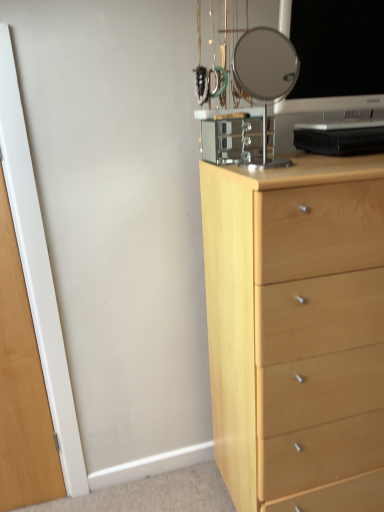
Question: From a real-world perspective, is black glossy computer monitor at upper right below light wood chest of drawers at right?

Choices:
 (A) no
 (B) yes

Answer: (A)

Question: Is black glossy computer monitor at upper right turned away from light wood chest of drawers at right?

Choices:
 (A) yes
 (B) no

Answer: (B)

Question: Is black glossy computer monitor at upper right positioned beyond the bounds of light wood chest of drawers at right?

Choices:
 (A) no
 (B) yes

Answer: (B)

Question: Can you confirm if black glossy computer monitor at upper right is positioned to the right of light wood chest of drawers at right?

Choices:
 (A) no
 (B) yes

Answer: (A)

Question: Is black glossy computer monitor at upper right in front of light wood chest of drawers at right?

Choices:
 (A) no
 (B) yes

Answer: (A)

Question: Relative to clear glass mirror at upper center, is black glossy computer monitor at upper right in front or behind?

Choices:
 (A) behind
 (B) front

Answer: (A)

Question: Considering the relative positions of black glossy computer monitor at upper right and clear glass mirror at upper center in the image provided, is black glossy computer monitor at upper right to the left or to the right of clear glass mirror at upper center?

Choices:
 (A) left
 (B) right

Answer: (B)

Question: Would you say black glossy computer monitor at upper right is inside or outside clear glass mirror at upper center?

Choices:
 (A) outside
 (B) inside

Answer: (A)

Question: Considering the positions of black glossy computer monitor at upper right and clear glass mirror at upper center in the image, is black glossy computer monitor at upper right bigger or smaller than clear glass mirror at upper center?

Choices:
 (A) big
 (B) small

Answer: (A)

Question: From the image's perspective, is black glossy computer monitor at upper right located above or below transparent glass door at left?

Choices:
 (A) below
 (B) above

Answer: (B)

Question: Based on their positions, is black glossy computer monitor at upper right located to the left or right of transparent glass door at left?

Choices:
 (A) left
 (B) right

Answer: (B)

Question: Looking at the image, does black glossy computer monitor at upper right seem bigger or smaller compared to transparent glass door at left?

Choices:
 (A) small
 (B) big

Answer: (A)

Question: Relative to transparent glass door at left, is black glossy computer monitor at upper right in front or behind?

Choices:
 (A) behind
 (B) front

Answer: (A)

Question: Is light wood chest of drawers at right in front of or behind clear glass mirror at upper center in the image?

Choices:
 (A) front
 (B) behind

Answer: (A)

Question: Looking at the image, does light wood chest of drawers at right seem bigger or smaller compared to clear glass mirror at upper center?

Choices:
 (A) big
 (B) small

Answer: (A)